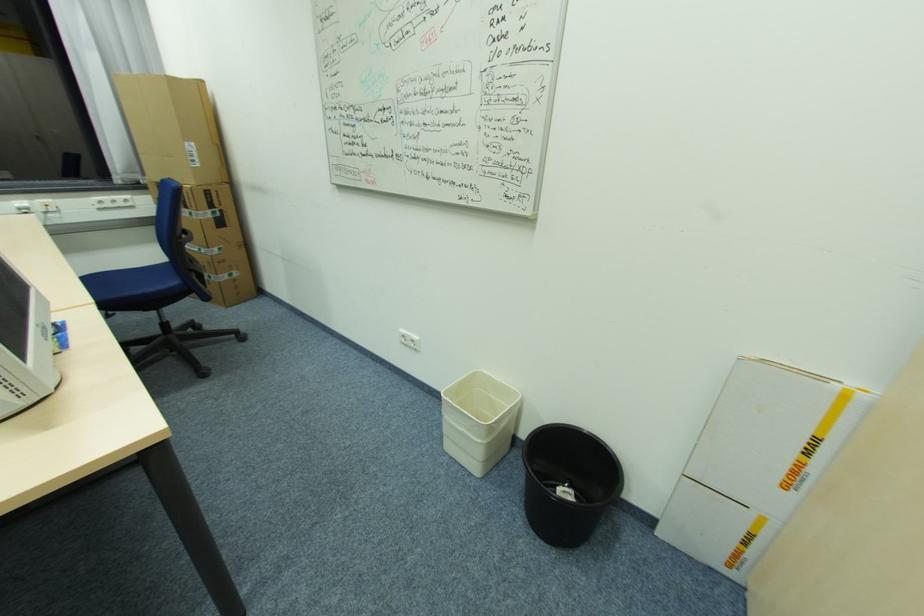
The location [189,172] corresponds to which object?

It corresponds to the tall cardboard box in the image.